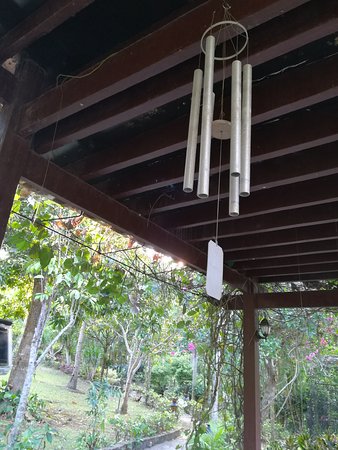
Locate an element on the screen. windchime on tag is located at coordinates (210, 279).